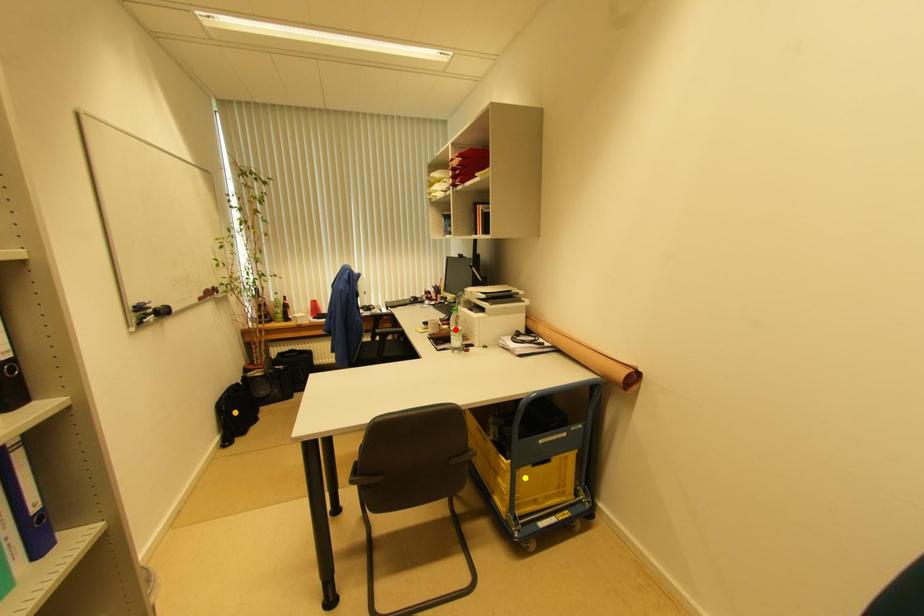
Order these from farthest to nearest:
- yellow point
- red point
- orange point

orange point, red point, yellow point